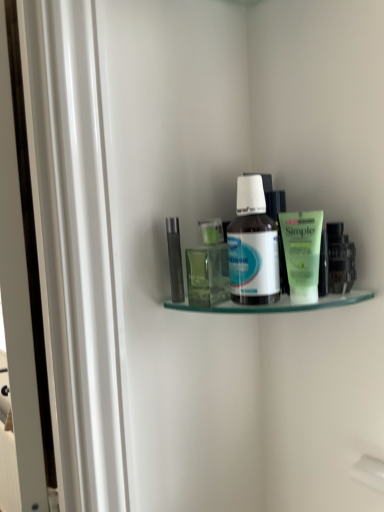
Question: In terms of height, does translucent plastic bottle at center, which ranks as the 3th toiletry in right-to-left order, look taller or shorter compared to white glossy bottle at center?

Choices:
 (A) short
 (B) tall

Answer: (A)

Question: Looking at their shapes, would you say translucent plastic bottle at center, which ranks as the 3th toiletry in right-to-left order, is wider or thinner than white glossy bottle at center?

Choices:
 (A) wide
 (B) thin

Answer: (B)

Question: Estimate the real-world distances between objects in this image. Which object is farther from the green matte tube at upper right, marked as the 3th toiletry in a left-to-right arrangement?

Choices:
 (A) clear glass shelf at upper center
 (B) translucent plastic bottle at center, the 2th toiletry from the left
 (C) white glossy bottle at center
 (D) transparent plastic bottle at center, arranged as the fourth toiletry when viewed from the right
 (E) green matte tube at right, which ranks as the first toiletry in right-to-left order

Answer: (D)

Question: Considering the real-world distances, which object is closest to the white glossy bottle at center?

Choices:
 (A) clear glass shelf at upper center
 (B) transparent plastic bottle at center, arranged as the fourth toiletry when viewed from the right
 (C) green matte tube at right, the 4th toiletry positioned from the left
 (D) green matte tube at upper right, marked as the 3th toiletry in a left-to-right arrangement
 (E) translucent plastic bottle at center, the 2th toiletry from the left

Answer: (D)